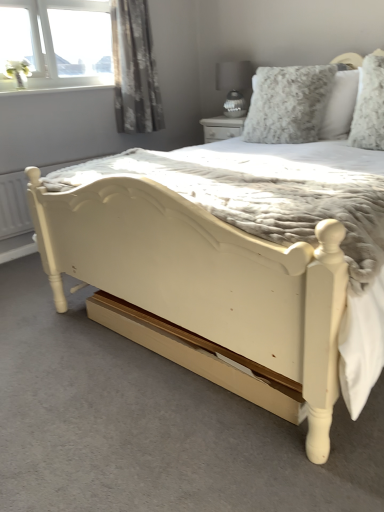
Question: Is floral gray curtain at upper left smaller than fluffy white pillow at upper right, positioned as the first pillow in right-to-left order?

Choices:
 (A) yes
 (B) no

Answer: (B)

Question: Does floral gray curtain at upper left contain fluffy white pillow at upper right, positioned as the first pillow in right-to-left order?

Choices:
 (A) yes
 (B) no

Answer: (B)

Question: Is floral gray curtain at upper left located outside fluffy white pillow at upper right, placed as the second pillow when sorted from left to right?

Choices:
 (A) yes
 (B) no

Answer: (A)

Question: Is floral gray curtain at upper left at the left side of fluffy white pillow at upper right, placed as the second pillow when sorted from left to right?

Choices:
 (A) no
 (B) yes

Answer: (B)

Question: From the image's perspective, is floral gray curtain at upper left on top of fluffy white pillow at upper right, placed as the second pillow when sorted from left to right?

Choices:
 (A) yes
 (B) no

Answer: (A)

Question: Could you tell me if floral gray curtain at upper left is turned towards fluffy white pillow at upper right, positioned as the first pillow in right-to-left order?

Choices:
 (A) no
 (B) yes

Answer: (B)

Question: Can you confirm if matte gray glass lamp at upper center is shorter than fluffy gray pillow at upper right, the second pillow from the right?

Choices:
 (A) yes
 (B) no

Answer: (A)

Question: Does matte gray glass lamp at upper center have a lesser width compared to fluffy gray pillow at upper right, the second pillow from the right?

Choices:
 (A) yes
 (B) no

Answer: (B)

Question: From a real-world perspective, is matte gray glass lamp at upper center physically below fluffy gray pillow at upper right, the second pillow from the right?

Choices:
 (A) yes
 (B) no

Answer: (B)

Question: Is matte gray glass lamp at upper center aimed at fluffy gray pillow at upper right, which is counted as the 1th pillow, starting from the left?

Choices:
 (A) no
 (B) yes

Answer: (A)

Question: Is fluffy gray pillow at upper right, the second pillow from the right, completely or partially inside matte gray glass lamp at upper center?

Choices:
 (A) yes
 (B) no

Answer: (B)

Question: From the image's perspective, is matte gray glass lamp at upper center beneath fluffy gray pillow at upper right, the second pillow from the right?

Choices:
 (A) yes
 (B) no

Answer: (B)

Question: Does fluffy white pillow at upper right, positioned as the first pillow in right-to-left order, have a lesser width compared to floral gray curtain at upper left?

Choices:
 (A) yes
 (B) no

Answer: (A)